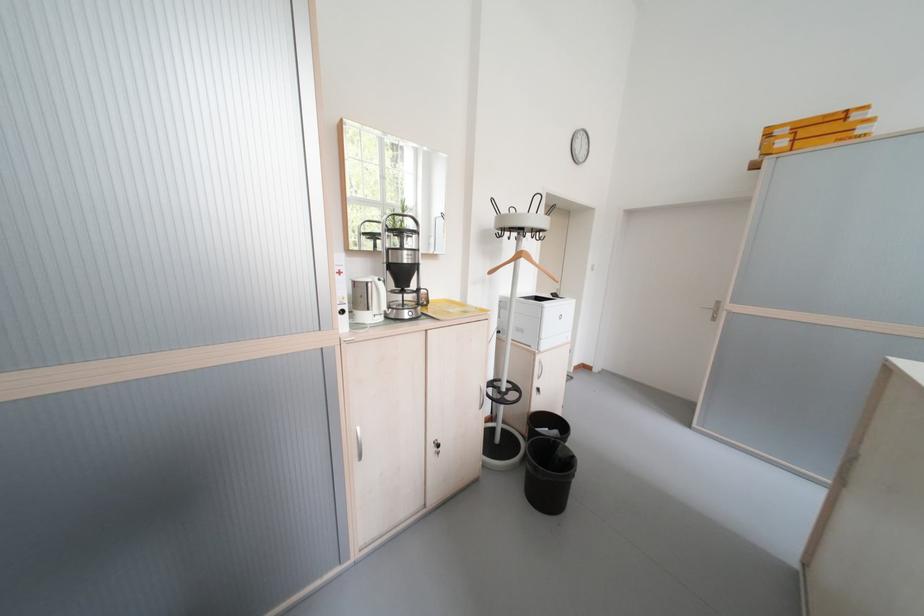
The height and width of the screenshot is (616, 924). In order to click on coffee carafe handle in this screenshot , I will do `click(402, 267)`.